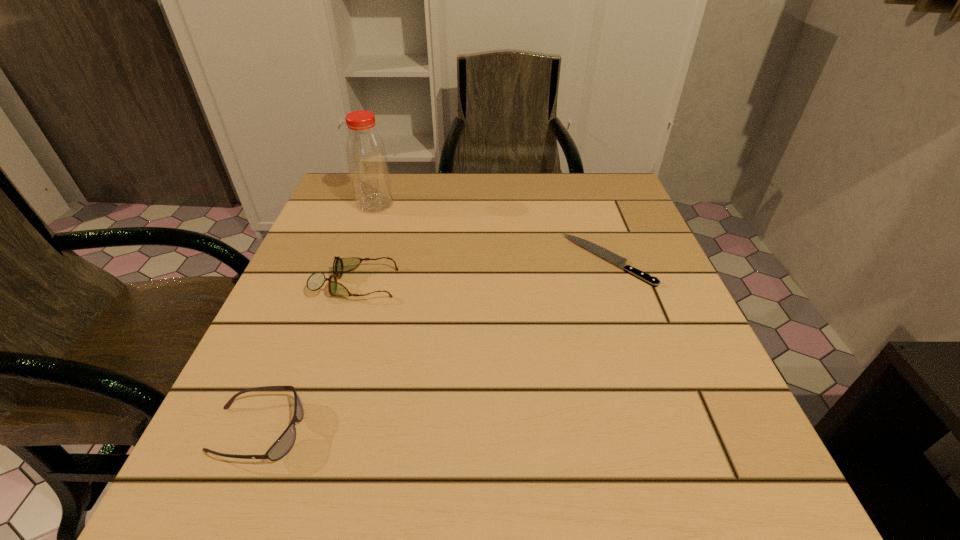
In the image, there is a desktop. Where is `vacant area at the left edge`? This screenshot has width=960, height=540. vacant area at the left edge is located at coordinates (287, 401).

The width and height of the screenshot is (960, 540). Identify the location of vacant space at the right edge of the desktop. (657, 245).

Where is `vacant space at the far left corner`? The height and width of the screenshot is (540, 960). vacant space at the far left corner is located at coordinates (346, 204).

In the image, there is a desktop. Find the location of `vacant space at the near left corner`. vacant space at the near left corner is located at coordinates (291, 461).

Find the location of a particular element. The height and width of the screenshot is (540, 960). free space at the far right corner of the desktop is located at coordinates (587, 202).

Locate an element on the screen. This screenshot has width=960, height=540. vacant area at the near right corner of the desktop is located at coordinates (745, 510).

The height and width of the screenshot is (540, 960). Identify the location of free space between the nearest object and the spectacles. (306, 357).

Where is `vacant space that's between the sunglasses and the farthest object`? vacant space that's between the sunglasses and the farthest object is located at coordinates (317, 318).

Image resolution: width=960 pixels, height=540 pixels. Identify the location of blank region between the nearest object and the tallest object. (317, 318).

Where is `empty location between the spectacles and the bottle`? empty location between the spectacles and the bottle is located at coordinates (366, 244).